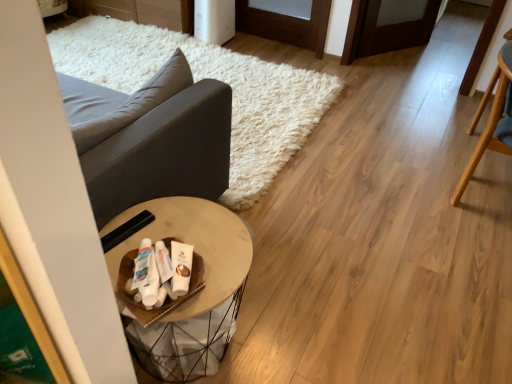
Question: Considering the positions of white glossy tube at center, the 2th toiletry from the left, and white matte toothpaste tube at center, which is counted as the 1th toiletry, starting from the left, in the image, is white glossy tube at center, the 2th toiletry from the left, bigger or smaller than white matte toothpaste tube at center, which is counted as the 1th toiletry, starting from the left,?

Choices:
 (A) big
 (B) small

Answer: (A)

Question: Looking at their shapes, would you say white glossy tube at center, the 2th toiletry from the left, is wider or thinner than white matte toothpaste tube at center, which is counted as the 1th toiletry, starting from the left?

Choices:
 (A) thin
 (B) wide

Answer: (B)

Question: Which of these objects is positioned closest to the white matte toothpaste tube at center, which is counted as the 1th toiletry, starting from the left?

Choices:
 (A) matte black side table at center
 (B) white glossy tube at center, which appears as the 2th toiletry when viewed from the right
 (C) wooden round table at center
 (D) light brown wooden chair at right, which ranks as the 1th chair in back-to-front order
 (E) light wood chair at right, acting as the first chair starting from the front

Answer: (B)

Question: Estimate the real-world distances between objects in this image. Which object is closer to the dark gray fabric couch at left?

Choices:
 (A) white matte toothpaste tube at center, the third toiletry from the right
 (B) light brown wooden chair at right, which ranks as the second chair in front-to-back order
 (C) wooden round table at center
 (D) white matte lotion at center, arranged as the first toiletry when viewed from the right
 (E) matte black side table at center

Answer: (C)